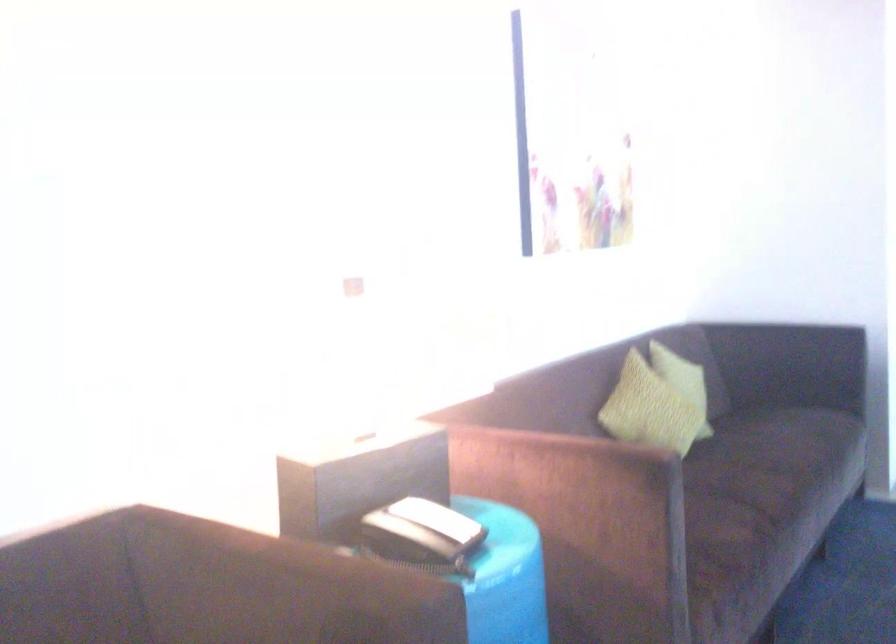
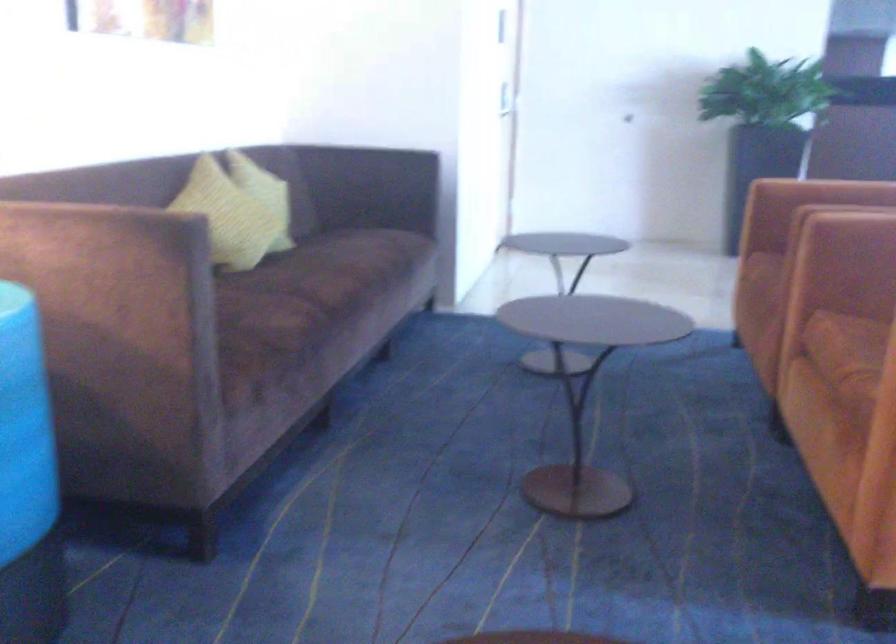
Question: The camera is either moving clockwise (left) or counter-clockwise (right) around the object. The first image is from the beginning of the video and the second image is from the end. Is the camera moving left or right when shooting the video?

Choices:
 (A) Left
 (B) Right

Answer: (A)